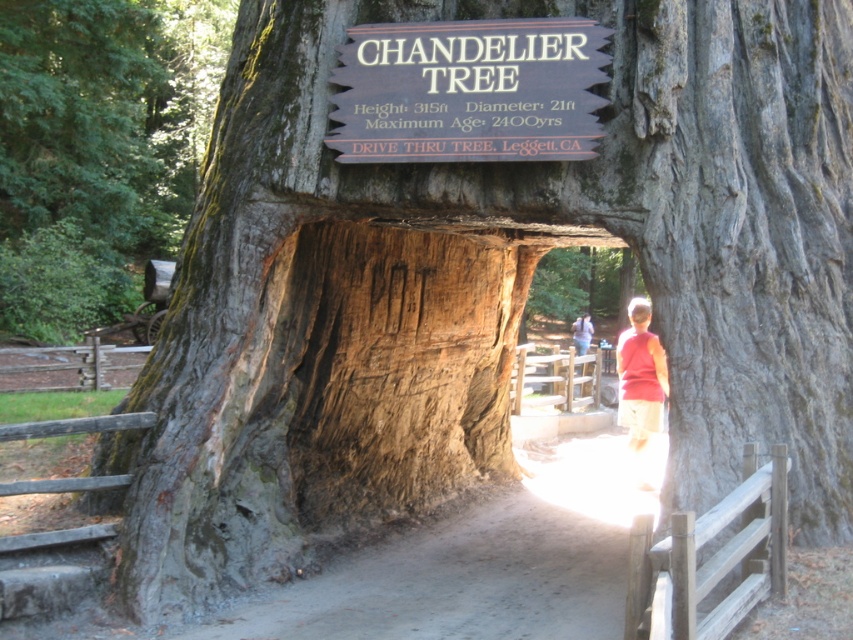
Does wooden sign at center appear on the right side of red cotton shirt at center?

Incorrect, wooden sign at center is not on the right side of red cotton shirt at center.

Does wooden sign at center have a greater height compared to red cotton shirt at center?

No, wooden sign at center is not taller than red cotton shirt at center.

Between point (500, 44) and point (634, 376), which one is positioned behind?

Positioned behind is point (634, 376).

I want to click on wooden sign at center, so click(469, 90).

Who is more forward, (474, 77) or (587, 337)?

Point (474, 77) is more forward.

Does wooden sign at center come in front of red shirt at center?

Yes, wooden sign at center is closer to the viewer.

Which is in front, point (540, 104) or point (581, 328)?

Positioned in front is point (540, 104).

Where is `wooden sign at center`? Image resolution: width=853 pixels, height=640 pixels. wooden sign at center is located at coordinates (469, 90).

In the scene shown: Can you confirm if red cotton shirt at center is shorter than red shirt at center?

No.

Does red cotton shirt at center come in front of red shirt at center?

Yes.

Where is `red cotton shirt at center`? red cotton shirt at center is located at coordinates (640, 378).